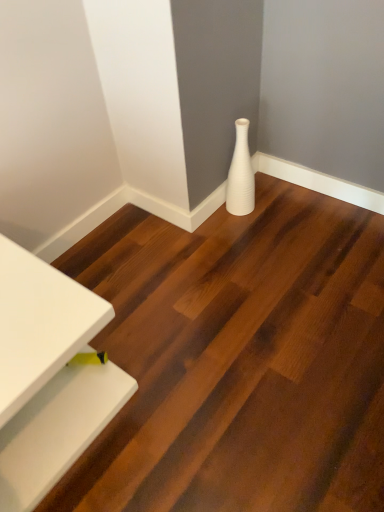
Image resolution: width=384 pixels, height=512 pixels. What do you see at coordinates (48, 376) in the screenshot?
I see `white glossy table at lower left` at bounding box center [48, 376].

Where is `white glossy table at lower left`? white glossy table at lower left is located at coordinates (48, 376).

Can you tell me how much white glossy vase at center and white glossy table at lower left differ in facing direction?

The angle between the facing direction of white glossy vase at center and the facing direction of white glossy table at lower left is 90.1 degrees.

Is white glossy vase at center positioned with its back to white glossy table at lower left?

No, white glossy vase at center is not facing away from white glossy table at lower left.

From a real-world perspective, who is located higher, white glossy vase at center or white glossy table at lower left?

In real-world perspective, white glossy table at lower left is above.

Considering the positions of point (259, 367) and point (17, 489), is point (259, 367) closer or farther from the camera than point (17, 489)?

Clearly, point (259, 367) is more distant from the camera than point (17, 489).

Is white ribbed vase at lower right beside white glossy table at lower left?

No, white ribbed vase at lower right is not beside white glossy table at lower left.

Is white ribbed vase at lower right positioned beyond the bounds of white glossy table at lower left?

Yes.

Measure the distance between white ribbed vase at lower right and white glossy table at lower left.

The distance of white ribbed vase at lower right from white glossy table at lower left is 35.36 inches.

Considering the positions of points (237, 178) and (57, 396), is point (237, 178) closer to camera compared to point (57, 396)?

No, it is not.

Identify the location of table above the white ribbed vase at lower right (from a real-world perspective). This screenshot has width=384, height=512. (48, 376).

Is point (16, 495) behind point (236, 206)?

No.

Can you confirm if white glossy table at lower left is wider than white ribbed vase at lower right?

Yes.

Is the depth of white glossy table at lower left greater than that of white ribbed vase at lower right?

No, the depth of white glossy table at lower left is less than that of white ribbed vase at lower right.

At what (x,y) coordinates should I click in order to perform the action: click on stair on the right of the white glossy table at lower left. Please return your answer as a coordinate pair (x, y). The width and height of the screenshot is (384, 512). Looking at the image, I should click on (239, 359).

Is white glossy table at lower left with white glossy vase at center?

No, white glossy table at lower left is not making contact with white glossy vase at center.

Would you say white glossy table at lower left is outside white glossy vase at center?

Yes, white glossy table at lower left is located beyond the bounds of white glossy vase at center.

The height and width of the screenshot is (512, 384). I want to click on stair in front of the white ribbed vase at lower right, so click(239, 359).

Are white glossy vase at center and white ribbed vase at lower right far apart?

They are positioned close to each other.

Is point (243, 334) farther from viewer compared to point (238, 189)?

No, it is in front of (238, 189).

Looking at this image, is white ribbed vase at lower right far away from white glossy vase at center?

No, white ribbed vase at lower right is not far from white glossy vase at center.

Considering the sizes of white ribbed vase at lower right and white glossy vase at center in the image, is white ribbed vase at lower right bigger or smaller than white glossy vase at center?

white ribbed vase at lower right is smaller than white glossy vase at center.

Is white ribbed vase at lower right positioned beyond the bounds of white glossy vase at center?

Absolutely, white ribbed vase at lower right is external to white glossy vase at center.

Where is `table behind the white glossy vase at center`? This screenshot has width=384, height=512. table behind the white glossy vase at center is located at coordinates (48, 376).

The image size is (384, 512). In order to click on table in front of the white ribbed vase at lower right in this screenshot , I will do point(48,376).

Which object lies further to the anchor point white ribbed vase at lower right, white glossy table at lower left or white glossy vase at center?

white glossy table at lower left.

Based on their spatial positions, is white ribbed vase at lower right or white glossy vase at center further from white glossy table at lower left?

Among the two, white ribbed vase at lower right is located further to white glossy table at lower left.

Which object lies further to the anchor point white glossy vase at center, white ribbed vase at lower right or white glossy table at lower left?

white ribbed vase at lower right is further to white glossy vase at center.

Which object lies further to the anchor point white glossy table at lower left, white glossy vase at center or white ribbed vase at lower right?

white ribbed vase at lower right is positioned further to the anchor white glossy table at lower left.

Estimate the real-world distances between objects in this image. Which object is closer to white ribbed vase at lower right, white glossy vase at center or white glossy table at lower left?

white glossy vase at center lies closer to white ribbed vase at lower right than the other object.

Looking at this image, from the image, which object appears to be farther from white glossy vase at center, white glossy table at lower left or white ribbed vase at lower right?

white ribbed vase at lower right lies further to white glossy vase at center than the other object.

This screenshot has width=384, height=512. What are the coordinates of `table positioned between white glossy vase at center and white ribbed vase at lower right from near to far` in the screenshot? It's located at (48, 376).